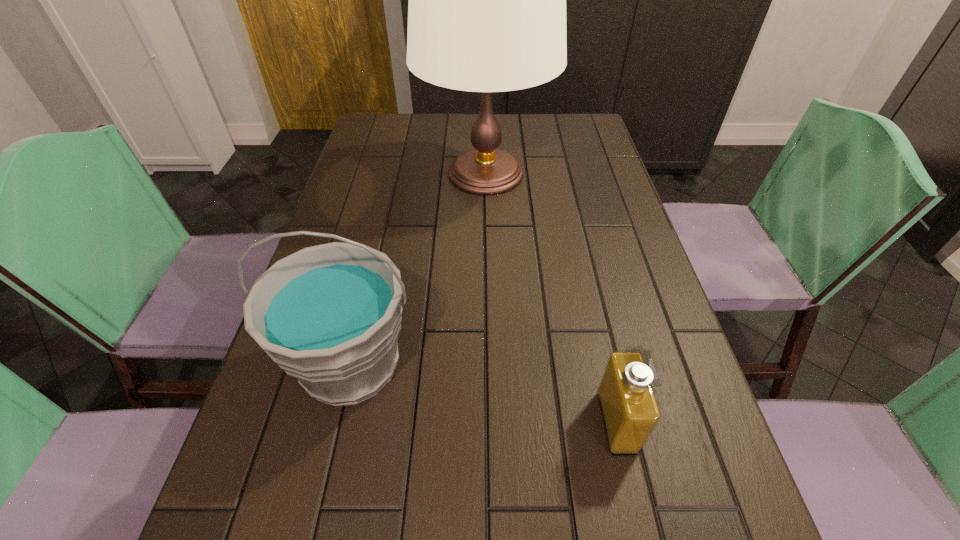
You are a GUI agent. You are given a task and a screenshot of the screen. Output one action in this format:
    pyautogui.click(x=<x>, y=<y>)
    Task: Click on the free spot between the farthest object and the rightmost object
    
    Given the screenshot: What is the action you would take?
    pyautogui.click(x=551, y=298)

What are the coordinates of `vacant area that lies between the lamp and the shortest object` in the screenshot? It's located at (551, 298).

You are a GUI agent. You are given a task and a screenshot of the screen. Output one action in this format:
    pyautogui.click(x=<x>, y=<y>)
    Task: Click on the vacant area that lies between the rightmost object and the tallest object
    
    Given the screenshot: What is the action you would take?
    pyautogui.click(x=551, y=298)

Locate an element on the screen. The width and height of the screenshot is (960, 540). object that is the second closest to the second shortest object is located at coordinates (487, 0).

The width and height of the screenshot is (960, 540). Identify the location of object that is the second closest one to the bucket. (487, 0).

I want to click on blank space that satisfies the following two spatial constraints: 1. on the back side of the bucket; 2. on the left side of the lamp, so click(396, 173).

At what (x,y) coordinates should I click in order to perform the action: click on free location that satisfies the following two spatial constraints: 1. on the back side of the second tallest object; 2. on the left side of the tallest object. Please return your answer as a coordinate pair (x, y). The image size is (960, 540). Looking at the image, I should click on (396, 173).